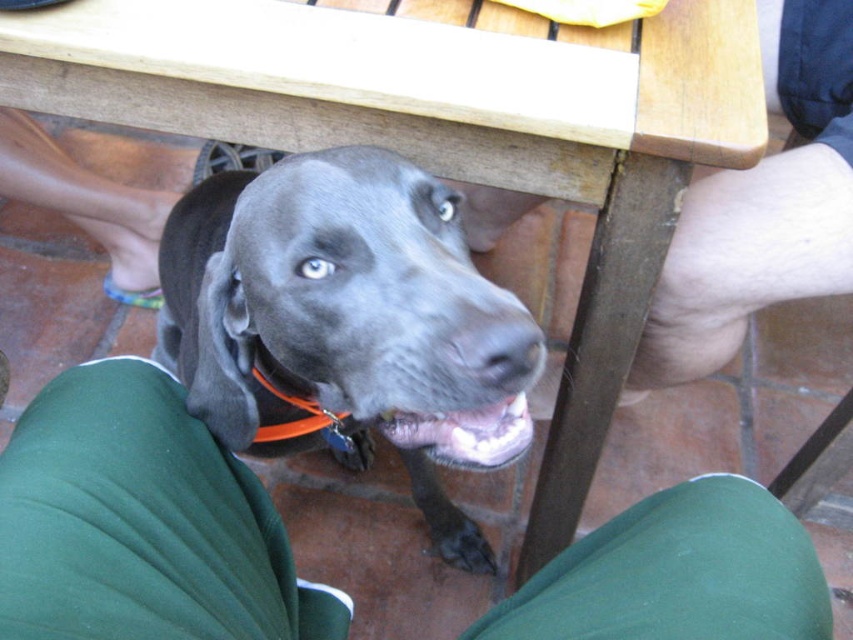
Question: Can you confirm if shiny black dog at center is smaller than orange plastic neckband at lower center?

Choices:
 (A) yes
 (B) no

Answer: (B)

Question: Does green fabric pants at lower center have a greater width compared to shiny black dog at center?

Choices:
 (A) yes
 (B) no

Answer: (A)

Question: Which point appears closest to the camera in this image?

Choices:
 (A) (167, 323)
 (B) (676, 596)

Answer: (B)

Question: Which of the following is the farthest from the observer?

Choices:
 (A) (325, 436)
 (B) (346, 310)

Answer: (A)

Question: Does shiny black dog at center appear on the right side of orange plastic neckband at lower center?

Choices:
 (A) no
 (B) yes

Answer: (B)

Question: Which point appears closest to the camera in this image?

Choices:
 (A) (27, 492)
 (B) (231, 268)
 (C) (341, 420)

Answer: (A)